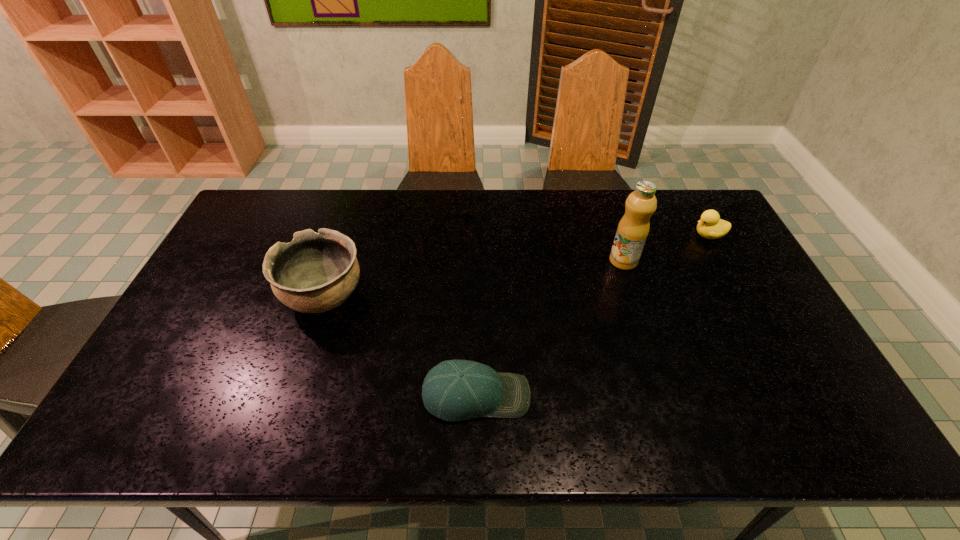
Identify the location of free spot between the tallest object and the farthest object. (666, 248).

The image size is (960, 540). I want to click on free space that is in between the rightmost object and the pottery, so click(x=516, y=266).

The image size is (960, 540). I want to click on free spot between the fruit juice and the second object from left to right, so click(550, 328).

Identify the location of free space between the nearest object and the fruit juice. pos(550,328).

Locate which object ranks third in proximity to the fruit juice. Please provide its 2D coordinates. Your answer should be formatted as a tuple, i.e. [(x, y)], where the tuple contains the x and y coordinates of a point satisfying the conditions above.

[(316, 272)]

Identify which object is located as the second nearest to the second object from left to right. Please provide its 2D coordinates. Your answer should be formatted as a tuple, i.e. [(x, y)], where the tuple contains the x and y coordinates of a point satisfying the conditions above.

[(633, 228)]

Locate an element on the screen. The height and width of the screenshot is (540, 960). vacant region that satisfies the following two spatial constraints: 1. on the front-facing side of the farthest object; 2. on the front label of the tallest object is located at coordinates (723, 261).

Identify the location of free location that satisfies the following two spatial constraints: 1. on the front-facing side of the rightmost object; 2. on the front side of the pottery. coord(743,297).